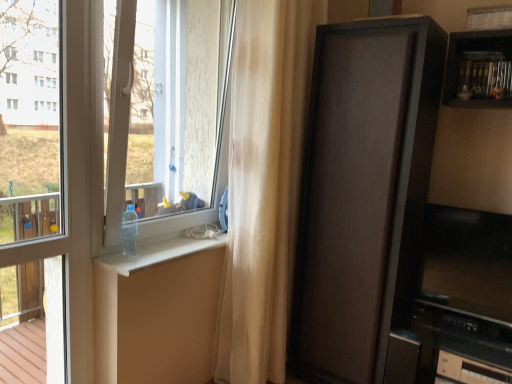
I want to click on vacant region under transparent plastic window screen at left (from a real-world perspective), so click(154, 246).